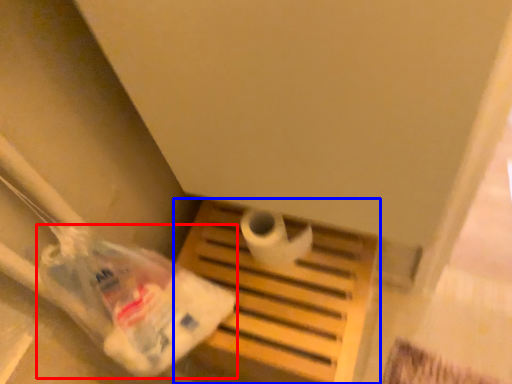
Question: Which object appears closest to the camera in this image, plastic bag (highlighted by a red box) or furniture (highlighted by a blue box)?

Choices:
 (A) plastic bag
 (B) furniture

Answer: (A)